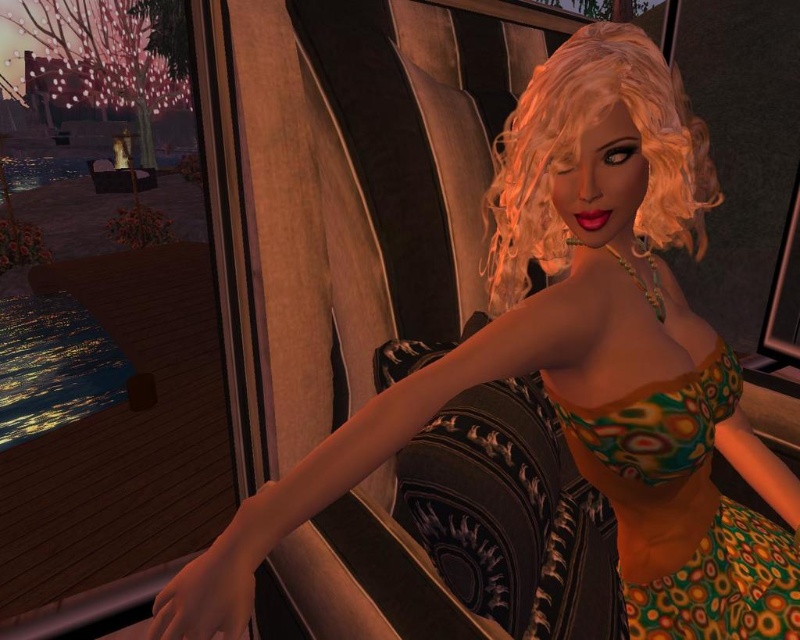
Question: Which point is farther from the camera taking this photo?

Choices:
 (A) (728, 499)
 (B) (712, 364)

Answer: (A)

Question: Does blonde curly wig at upper right have a larger size compared to multicolored printed bikini top at center?

Choices:
 (A) yes
 (B) no

Answer: (A)

Question: Which object is the farthest from the multicolored printed bikini top at center?

Choices:
 (A) blonde curly wig at upper right
 (B) multicolored printed dress at center

Answer: (A)

Question: Estimate the real-world distances between objects in this image. Which object is closer to the blonde curly wig at upper right?

Choices:
 (A) multicolored printed bikini top at center
 (B) multicolored printed dress at center

Answer: (A)

Question: Can you confirm if blonde curly wig at upper right is thinner than multicolored printed bikini top at center?

Choices:
 (A) no
 (B) yes

Answer: (A)

Question: Is blonde curly wig at upper right to the right of multicolored printed bikini top at center from the viewer's perspective?

Choices:
 (A) no
 (B) yes

Answer: (B)